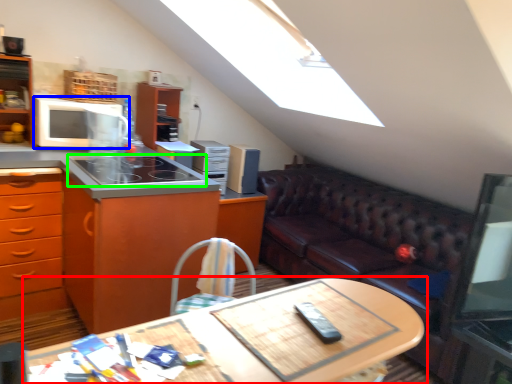
Question: Estimate the real-world distances between objects in this image. Which object is farther from table (highlighted by a red box), microwave oven (highlighted by a blue box) or gas stove (highlighted by a green box)?

Choices:
 (A) microwave oven
 (B) gas stove

Answer: (A)